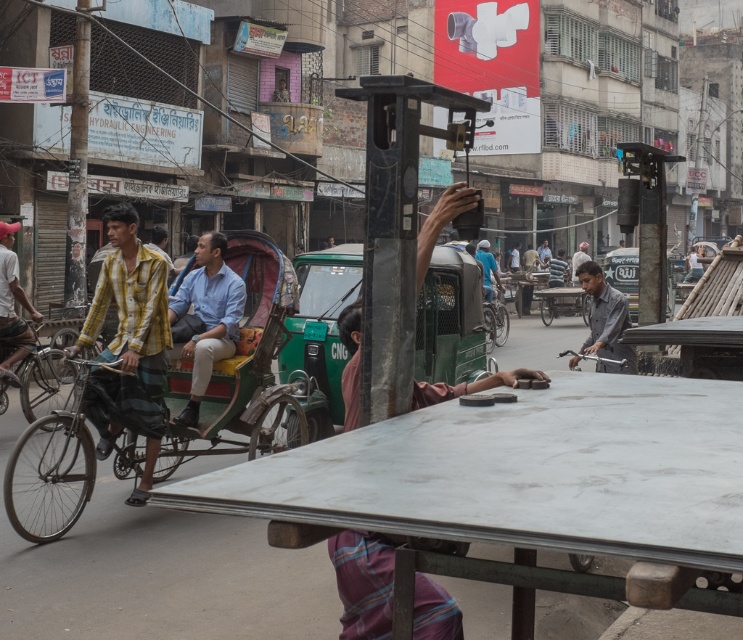
Question: Observing the image, what is the correct spatial positioning of yellow plaid shirt at left in reference to dark gray metallic phone at center?

Choices:
 (A) right
 (B) left

Answer: (B)

Question: Which object is the closest to the yellow striped shirt at left?

Choices:
 (A) green painted wood cart at left
 (B) dark gray metallic phone at center
 (C) light blue shirt at center
 (D) yellow plaid shirt at left

Answer: (C)

Question: Does dark gray metallic phone at center appear over gray matte shirt at center?

Choices:
 (A) no
 (B) yes

Answer: (A)

Question: Does dark gray metallic phone at center have a larger size compared to yellow striped shirt at left?

Choices:
 (A) no
 (B) yes

Answer: (A)

Question: Which point is farther to the camera?

Choices:
 (A) yellow plaid shirt at left
 (B) green painted wood cart at left

Answer: (B)

Question: Which point is closer to the camera taking this photo?

Choices:
 (A) (452, 636)
 (B) (7, 266)
 (C) (239, 300)
 (D) (149, 262)

Answer: (A)